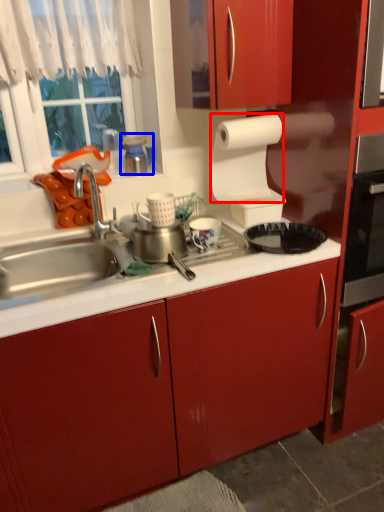
Question: Which point is closer to the camera, paper towel (highlighted by a red box) or appliance (highlighted by a blue box)?

Choices:
 (A) paper towel
 (B) appliance

Answer: (A)